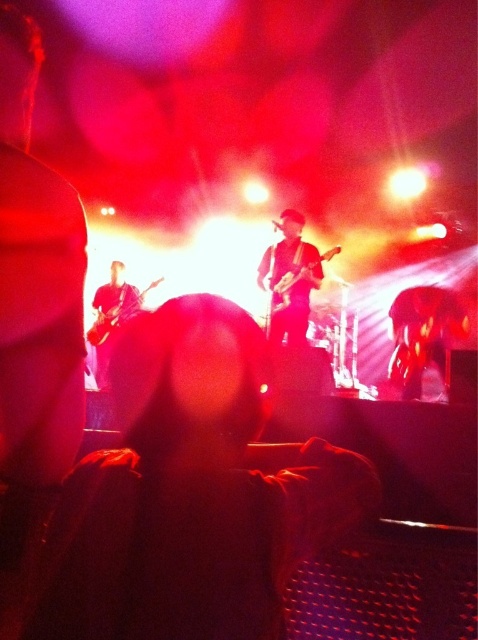
You are a stagehand who needs to place a rectangular box that is 1.2 meters wide on the stage. You have to choose between placing it next to the shiny black guitar at center or the matte black guitar at left. Which guitar should you place it next to so that the box fits without overlapping?

The shiny black guitar at center has a smaller width than the matte black guitar at left. Therefore, placing the 1.2 meter wide box next to the shiny black guitar at center would leave more space, ensuring it fits without overlapping.

You are a photographer at the concert. You need to capture a photo that includes both the shiny black guitar at center and the glossy black guitar at left. Based on their positions, which guitar should you focus on first to ensure both are in frame?

The shiny black guitar at center is to the right of the glossy black guitar at left. Therefore, to include both in the frame, you should focus on the glossy black guitar at left first as it is positioned further to the left, allowing you to adjust the camera angle to include the shiny black guitar at center on the right side.

You are at the concert venue and want to take a photo of the two points on the stage. The first point is at coordinates point (268, 276) and the second point is at point (98, 296). Which point will appear larger in your camera view?

Point (268, 276) is closer to the viewer than point (98, 296), so it will appear larger in the camera view.